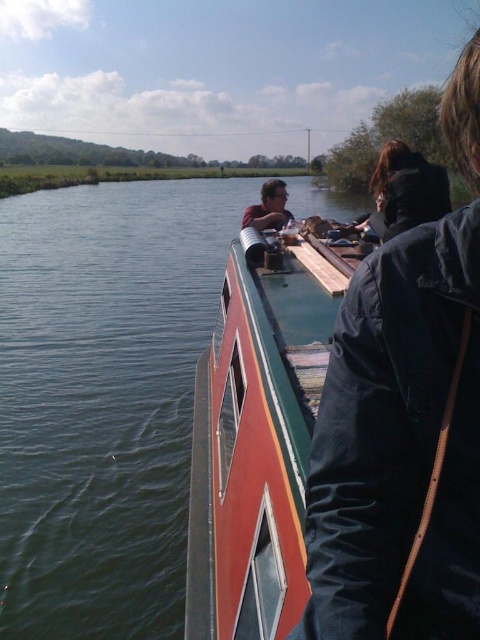
Question: Considering the relative positions of green smooth water at upper left and polished wood boat at center in the image provided, where is green smooth water at upper left located with respect to polished wood boat at center?

Choices:
 (A) above
 (B) below

Answer: (A)

Question: Which point is farther to the camera?

Choices:
 (A) green smooth water at upper left
 (B) dark blue jacket at upper right

Answer: (A)

Question: Which point is closer to the camera taking this photo?

Choices:
 (A) (385, 403)
 (B) (148, 467)
 (C) (267, 211)
 (D) (236, 570)

Answer: (A)

Question: In this image, where is green smooth water at upper left located relative to dark blue jacket at upper right?

Choices:
 (A) below
 (B) above

Answer: (B)

Question: Observing the image, what is the correct spatial positioning of green smooth water at upper left in reference to polished wood boat at center?

Choices:
 (A) left
 (B) right

Answer: (A)

Question: Which object is the closest to the matte black jacket at center?

Choices:
 (A) green smooth water at upper left
 (B) dark blue jacket at upper right

Answer: (B)